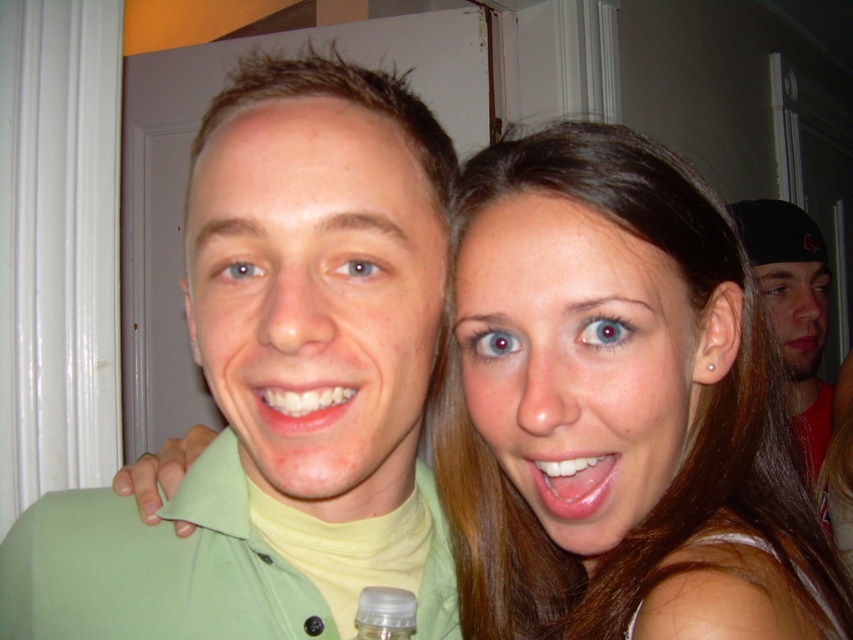
Question: Among these objects, which one is nearest to the camera?

Choices:
 (A) white glossy teeth at center
 (B) black matte cap at right
 (C) transparent plastic bottle at lower center
 (D) smooth skin face at center

Answer: (C)

Question: Which of the following is the closest to the observer?

Choices:
 (A) black matte cap at right
 (B) glossy white teeth at center

Answer: (B)

Question: Does black matte cap at right lie in front of white glossy teeth at center?

Choices:
 (A) no
 (B) yes

Answer: (A)

Question: Does glossy white teeth at center have a larger size compared to white glossy teeth at center?

Choices:
 (A) no
 (B) yes

Answer: (B)

Question: Which of these objects is positioned closest to the glossy white teeth at center?

Choices:
 (A) white glossy teeth at center
 (B) pink glossy lips at center
 (C) transparent plastic bottle at lower center
 (D) black matte cap at right

Answer: (C)

Question: Does glossy white teeth at center appear on the right side of pink glossy lips at center?

Choices:
 (A) yes
 (B) no

Answer: (B)